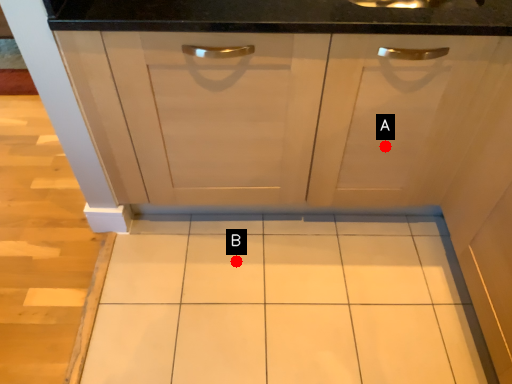
Question: Two points are circled on the image, labeled by A and B beside each circle. Which of the following is the closest to the observer?

Choices:
 (A) A is closer
 (B) B is closer

Answer: (A)